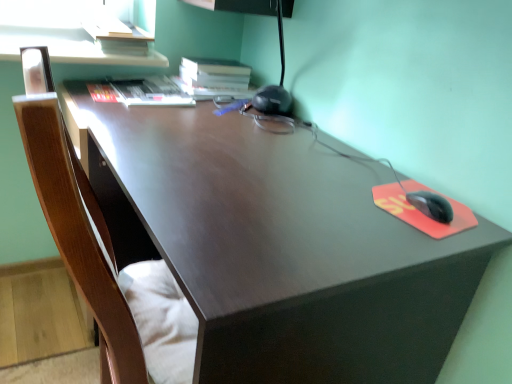
Find the location of a particular element. This screenshot has height=384, width=512. vacant space that's between hardcover book at upper center, the second book viewed from the left, and hardcover book at upper left, the first book viewed from the left is located at coordinates (209, 102).